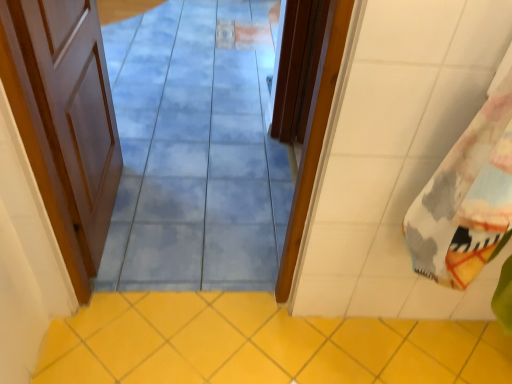
Question: Which is correct: yellow ceramic tile at lower center is inside printed cotton beach towel at right, or outside of it?

Choices:
 (A) inside
 (B) outside

Answer: (B)

Question: From a real-world perspective, relative to printed cotton beach towel at right, is yellow ceramic tile at lower center vertically above or below?

Choices:
 (A) below
 (B) above

Answer: (A)

Question: Estimate the real-world distances between objects in this image. Which object is farther from the yellow ceramic tile at lower center?

Choices:
 (A) printed cotton beach towel at right
 (B) white wood door at left, the 1th door viewed from the left
 (C) blue glossy tile at center
 (D) wooden door at center, the first door viewed from the right

Answer: (C)

Question: Based on their relative distances, which object is farther from the blue glossy tile at center?

Choices:
 (A) white wood door at left, the 1th door viewed from the left
 (B) yellow ceramic tile at lower center
 (C) printed cotton beach towel at right
 (D) wooden door at center, positioned as the second door in left-to-right order

Answer: (C)